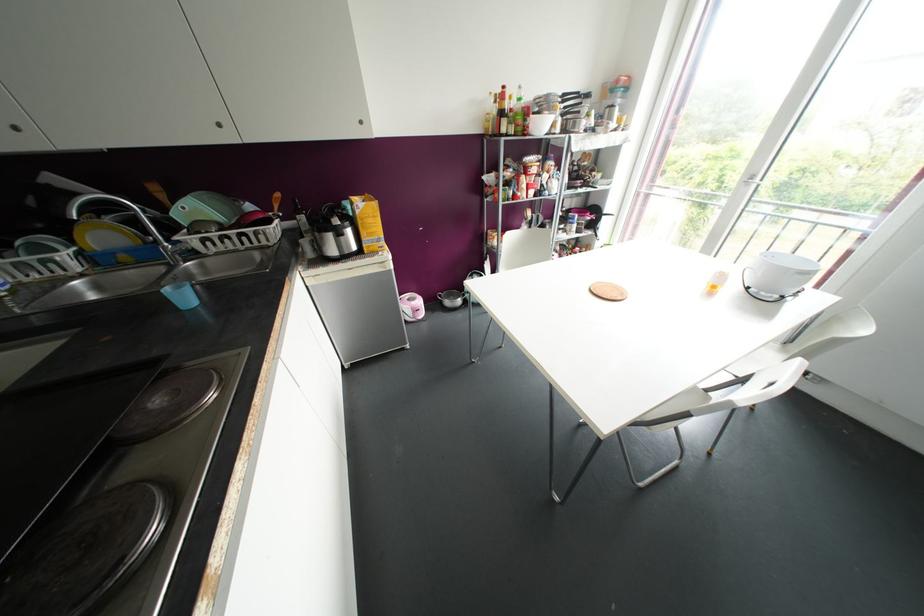
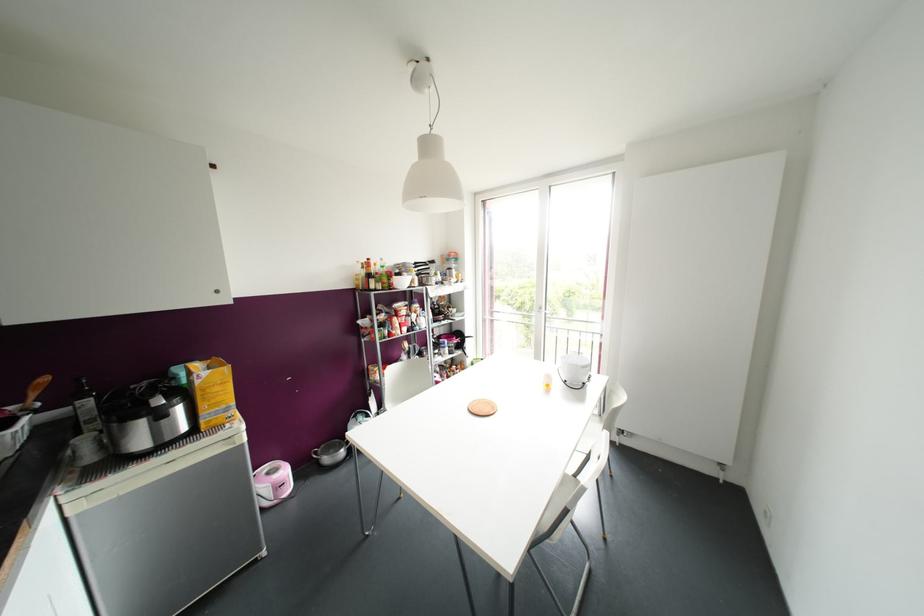
Based on the continuous images, in which direction is the camera rotating?

The camera rotated toward right-up.